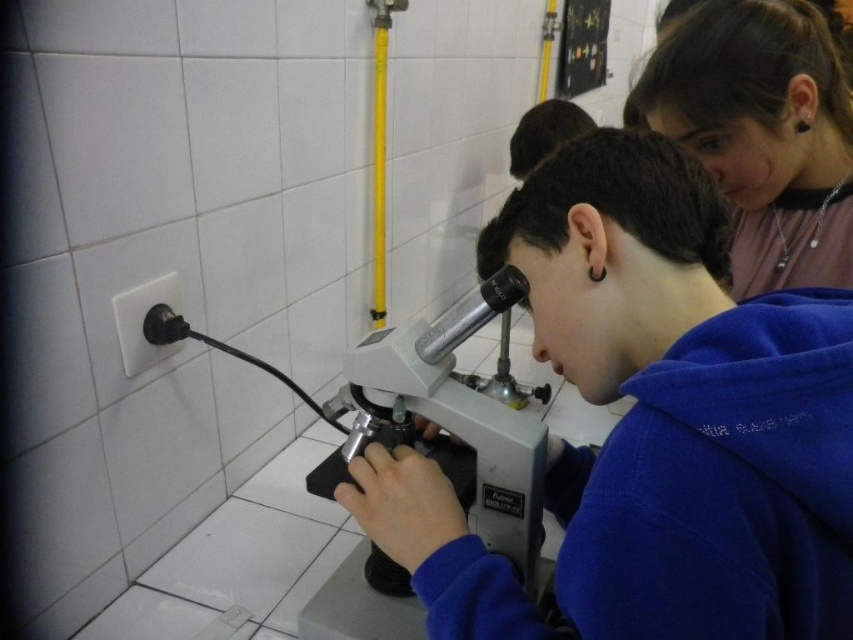
Does blue fleece at center come behind metallic silver bulletin board at upper center?

That is False.

Looking at this image, is blue fleece at center bigger than metallic silver bulletin board at upper center?

No.

Who is more forward, (775, 445) or (584, 13)?

Point (775, 445) is more forward.

Find the location of a particular element. This screenshot has width=853, height=640. blue fleece at center is located at coordinates (650, 424).

Between matte pink shirt at upper right and silver metallic microscope at center, which one is positioned higher?

matte pink shirt at upper right is above.

Measure the distance between matte pink shirt at upper right and silver metallic microscope at center.

The distance of matte pink shirt at upper right from silver metallic microscope at center is 20.03 inches.

Locate an element on the screen. This screenshot has height=640, width=853. matte pink shirt at upper right is located at coordinates (762, 132).

Identify the location of matte pink shirt at upper right. (762, 132).

Is silver metallic microscope at center thinner than metallic silver bulletin board at upper center?

Correct, silver metallic microscope at center's width is less than metallic silver bulletin board at upper center's.

Is silver metallic microscope at center to the left of metallic silver bulletin board at upper center from the viewer's perspective?

Correct, you'll find silver metallic microscope at center to the left of metallic silver bulletin board at upper center.

At what (x,y) coordinates should I click in order to perform the action: click on silver metallic microscope at center. Please return your answer as a coordinate pair (x, y). Looking at the image, I should click on (448, 422).